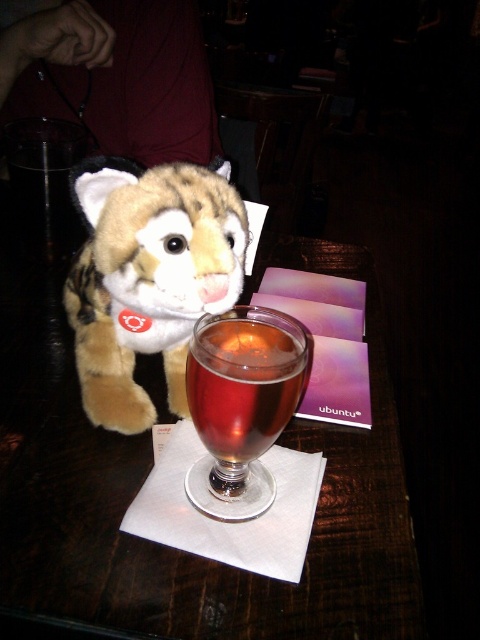
Who is taller, fuzzy brown plush toy at upper left or translucent glass wine glass at center?

fuzzy brown plush toy at upper left

Who is lower down, fuzzy brown plush toy at upper left or translucent glass wine glass at center?

translucent glass wine glass at center is lower down.

This screenshot has height=640, width=480. I want to click on fuzzy brown plush toy at upper left, so click(147, 276).

Where is `fuzzy brown plush toy at upper left`? fuzzy brown plush toy at upper left is located at coordinates (147, 276).

Can you confirm if wooden table at center is positioned to the left of translucent glass wine glass at center?

Correct, you'll find wooden table at center to the left of translucent glass wine glass at center.

Is wooden table at center positioned behind translucent glass wine glass at center?

That is False.

Identify the location of wooden table at center. (151, 467).

This screenshot has width=480, height=640. I want to click on wooden table at center, so click(151, 467).

Does wooden table at center have a greater width compared to fuzzy brown plush toy at upper left?

Indeed, wooden table at center has a greater width compared to fuzzy brown plush toy at upper left.

What are the coordinates of `wooden table at center` in the screenshot? It's located at (151, 467).